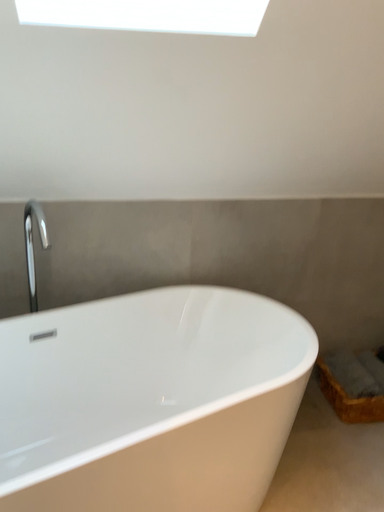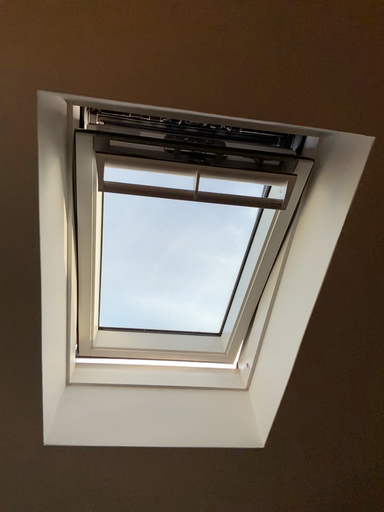
Question: How did the camera likely rotate when shooting the video?

Choices:
 (A) rotated downward
 (B) rotated upward

Answer: (B)